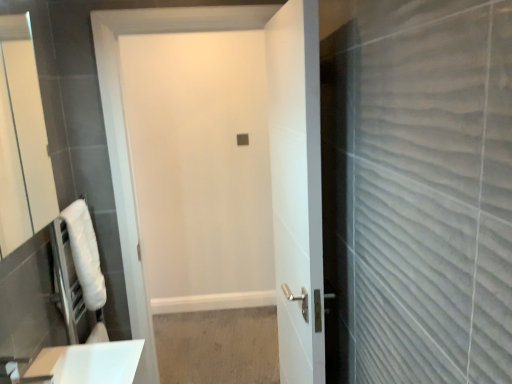
Question: Does matte white mirror at left have a lesser height compared to white matte door at center, acting as the 2th door starting from the right?

Choices:
 (A) no
 (B) yes

Answer: (B)

Question: Is matte white mirror at left positioned in front of white matte door at center, acting as the 2th door starting from the right?

Choices:
 (A) no
 (B) yes

Answer: (B)

Question: Is white matte door at center, the first door in the left-to-right sequence, completely or partially inside matte white mirror at left?

Choices:
 (A) no
 (B) yes

Answer: (A)

Question: Does matte white mirror at left turn towards white matte door at center, the first door in the left-to-right sequence?

Choices:
 (A) yes
 (B) no

Answer: (B)

Question: From a real-world perspective, is matte white mirror at left physically below white matte door at center, acting as the 2th door starting from the right?

Choices:
 (A) yes
 (B) no

Answer: (B)

Question: Is white matte door at center, acting as the 2th door starting from the right, to the left or to the right of matte white mirror at left in the image?

Choices:
 (A) right
 (B) left

Answer: (A)

Question: From their relative heights in the image, would you say white matte door at center, acting as the 2th door starting from the right, is taller or shorter than matte white mirror at left?

Choices:
 (A) tall
 (B) short

Answer: (A)

Question: From the image's perspective, is white matte door at center, acting as the 2th door starting from the right, located above or below matte white mirror at left?

Choices:
 (A) above
 (B) below

Answer: (B)

Question: Is white matte door at center, acting as the 2th door starting from the right, spatially inside matte white mirror at left, or outside of it?

Choices:
 (A) inside
 (B) outside

Answer: (B)

Question: Looking at the image, does white towel at left seem bigger or smaller compared to white glossy door at center, which ranks as the 2th door in left-to-right order?

Choices:
 (A) small
 (B) big

Answer: (A)

Question: In the image, is white towel at left positioned in front of or behind white glossy door at center, which ranks as the 2th door in left-to-right order?

Choices:
 (A) front
 (B) behind

Answer: (B)

Question: In the image, is white towel at left on the left side or the right side of white glossy door at center, which ranks as the 1th door in right-to-left order?

Choices:
 (A) left
 (B) right

Answer: (A)

Question: From the image's perspective, relative to white glossy door at center, which ranks as the 2th door in left-to-right order, is white towel at left above or below?

Choices:
 (A) above
 (B) below

Answer: (B)

Question: Considering the positions of matte white mirror at left and white matte door at center, the first door in the left-to-right sequence, in the image, is matte white mirror at left taller or shorter than white matte door at center, the first door in the left-to-right sequence,?

Choices:
 (A) tall
 (B) short

Answer: (B)

Question: Based on their sizes in the image, would you say matte white mirror at left is bigger or smaller than white matte door at center, acting as the 2th door starting from the right?

Choices:
 (A) big
 (B) small

Answer: (B)